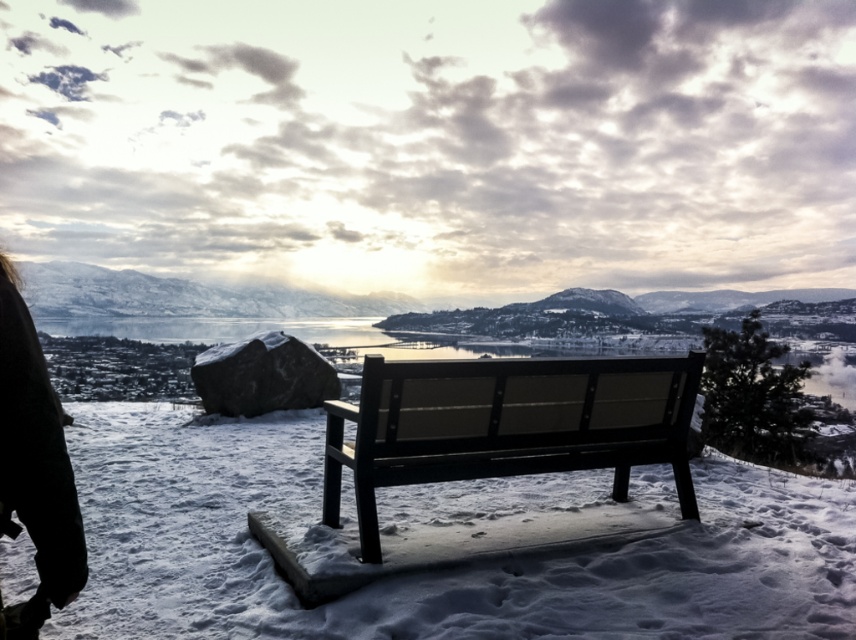
You are standing in the winter landscape scene and want to place a small decoration on the point that is closer to you. Which point should you choose between point (649, 580) and point (651, 376)?

You should choose point (649, 580) because it is closer to the camera than point (651, 376).

You are standing in the winter landscape scene and want to sit on the wooden bench. Which object, the white powdery snow at center or the black fabric at lower left, is closer to the bench?

The white powdery snow at center is closer to the bench because it is located below the black fabric at lower left, meaning it is positioned nearer to the bench compared to the black fabric.